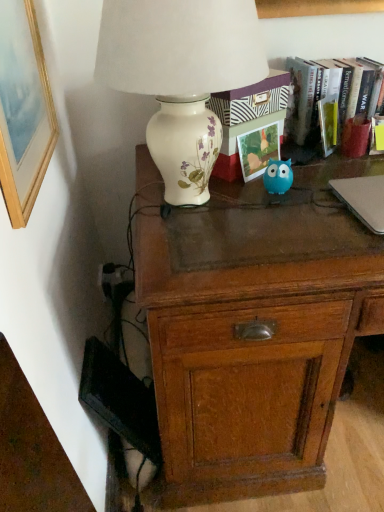
The height and width of the screenshot is (512, 384). Find the location of `empty space that is to the right of matte paper photo frame at center`. empty space that is to the right of matte paper photo frame at center is located at coordinates (319, 172).